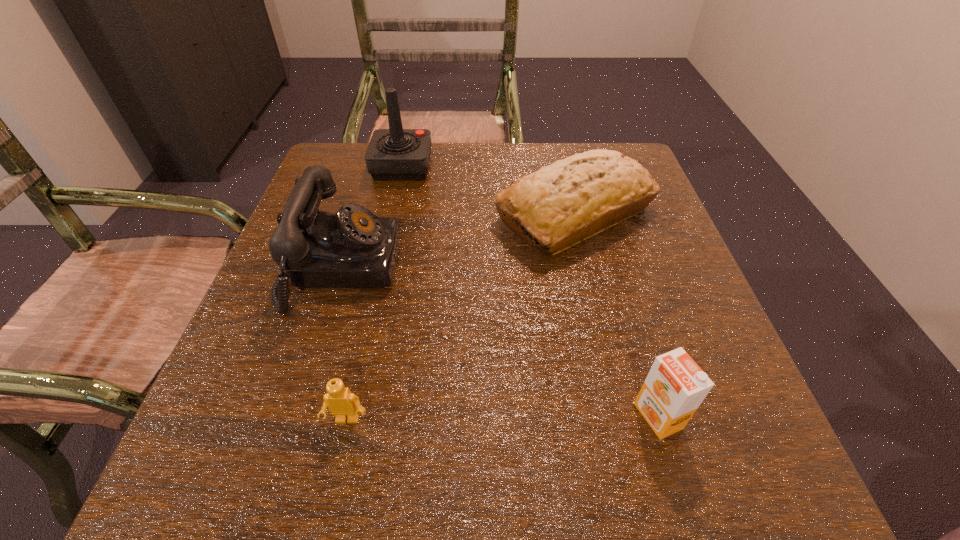
Find the location of a particular element. The height and width of the screenshot is (540, 960). vacant space that satisfies the following two spatial constraints: 1. on the front-facing side of the joystick; 2. on the left side of the orange juice is located at coordinates click(x=346, y=416).